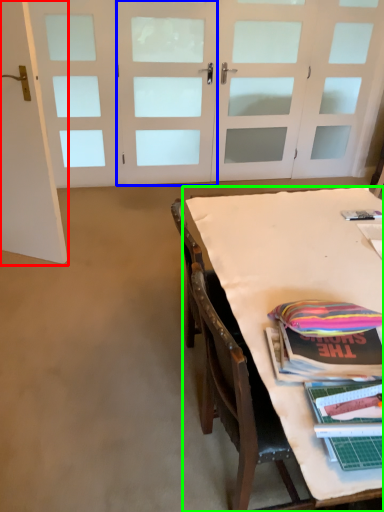
Question: Which object is the farthest from door (highlighted by a red box)? Choose among these: door (highlighted by a blue box) or table (highlighted by a green box).

Choices:
 (A) door
 (B) table

Answer: (A)